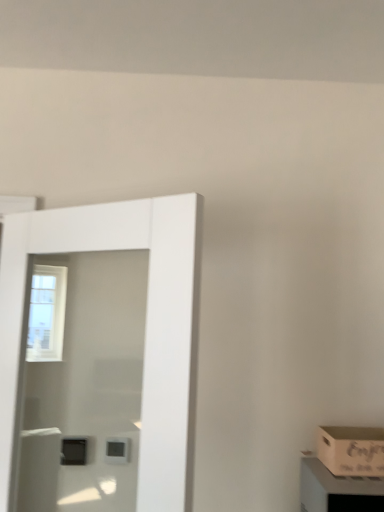
Identify the location of white glossy door at left. The image size is (384, 512). (145, 329).

Considering the positions of point (336, 448) and point (166, 286), is point (336, 448) closer or farther from the camera than point (166, 286)?

Point (336, 448) is positioned farther from the camera compared to point (166, 286).

Is wooden box at lower right inside the boundaries of white glossy door at left, or outside?

wooden box at lower right exists outside the volume of white glossy door at left.

Is wooden box at lower right wider than white glossy door at left?

Yes.

How many degrees apart are the facing directions of wooden box at lower right and white glossy door at left?

The facing directions of wooden box at lower right and white glossy door at left are 29.2 degrees apart.

Which point is more forward, (335, 439) or (383, 494)?

The point (383, 494) is in front.

From a real-world perspective, does wooden box at lower right sit lower than wooden crate at lower right?

No, from a real-world perspective, wooden box at lower right is not beneath wooden crate at lower right.

Between wooden box at lower right and wooden crate at lower right, which one has more height?

wooden crate at lower right is taller.

Which is correct: wooden crate at lower right is inside white glossy door at left, or outside of it?

wooden crate at lower right is not inside white glossy door at left, it's outside.

Is wooden crate at lower right far away from white glossy door at left?

They are positioned close to each other.

Could you tell me if wooden crate at lower right is facing white glossy door at left?

No.

What's the angular difference between white glossy door at left and wooden crate at lower right's facing directions?

29.2 degrees.

Considering the relative positions of white glossy door at left and wooden crate at lower right in the image provided, is white glossy door at left to the right of wooden crate at lower right from the viewer's perspective?

No, white glossy door at left is not to the right of wooden crate at lower right.

From the image's perspective, which one is positioned higher, white glossy door at left or wooden crate at lower right?

white glossy door at left.

Is wooden crate at lower right in contact with wooden box at lower right?

Yes, wooden crate at lower right and wooden box at lower right clearly make contact.

How many degrees apart are the facing directions of wooden crate at lower right and wooden box at lower right?

The angle between the facing direction of wooden crate at lower right and the facing direction of wooden box at lower right is 0.00459 degrees.

Does wooden crate at lower right have a larger size compared to wooden box at lower right?

Indeed, wooden crate at lower right has a larger size compared to wooden box at lower right.

Does wooden crate at lower right have a lesser width compared to wooden box at lower right?

Incorrect, the width of wooden crate at lower right is not less than that of wooden box at lower right.

Based on the photo, what's the angular difference between white glossy door at left and wooden box at lower right's facing directions?

The angle between the facing direction of white glossy door at left and the facing direction of wooden box at lower right is 29.2 degrees.

Is white glossy door at left positioned far away from wooden box at lower right?

No, white glossy door at left is not far from wooden box at lower right.

Would you say white glossy door at left is inside or outside wooden box at lower right?

white glossy door at left is not enclosed by wooden box at lower right.

The height and width of the screenshot is (512, 384). I want to click on box directly beneath the white glossy door at left (from a real-world perspective), so click(351, 450).

What are the coordinates of `cabinetry below the wooden box at lower right (from the image's perspective)` in the screenshot? It's located at (337, 490).

Looking at the image, which one is located closer to white glossy door at left, wooden crate at lower right or wooden box at lower right?

wooden crate at lower right is closer to white glossy door at left.

From the image, which object appears to be farther from wooden crate at lower right, white glossy door at left or wooden box at lower right?

The object further to wooden crate at lower right is white glossy door at left.

Based on their spatial positions, is wooden crate at lower right or white glossy door at left closer to wooden box at lower right?

Based on the image, wooden crate at lower right appears to be nearer to wooden box at lower right.

Which object lies further to the anchor point wooden crate at lower right, wooden box at lower right or white glossy door at left?

Among the two, white glossy door at left is located further to wooden crate at lower right.

Based on their spatial positions, is white glossy door at left or wooden crate at lower right further from wooden box at lower right?

white glossy door at left is further to wooden box at lower right.

Based on their spatial positions, is wooden box at lower right or wooden crate at lower right further from white glossy door at left?

Based on the image, wooden box at lower right appears to be further to white glossy door at left.

Image resolution: width=384 pixels, height=512 pixels. I want to click on cabinetry situated between white glossy door at left and wooden box at lower right from left to right, so click(x=337, y=490).